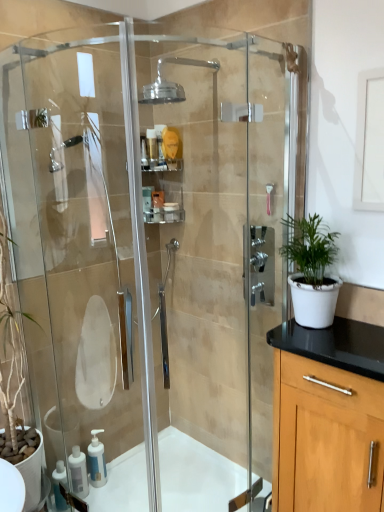
Question: Visually, is white glossy bath at lower left positioned to the left or to the right of clear plastic container at center, the 3th toiletry positioned from the bottom?

Choices:
 (A) left
 (B) right

Answer: (B)

Question: From the image's perspective, is white glossy bath at lower left located above or below clear plastic container at center, the 3th toiletry positioned from the bottom?

Choices:
 (A) above
 (B) below

Answer: (B)

Question: Which object is positioned closest to the transparent glass shower door at left?

Choices:
 (A) clear plastic shelf at upper center
 (B) white glossy bath at lower left
 (C) clear glass shower head at upper center
 (D) white matte pot at right
 (E) white plastic soap dispenser at lower left, arranged as the second soap dispenser when viewed from the left

Answer: (B)

Question: Which is farther from the white glossy bath at lower left?

Choices:
 (A) translucent plastic soap dispenser at lower left, acting as the 1th soap dispenser starting from the left
 (B) clear glass shower head at upper center
 (C) matte plastic container at upper center, which is counted as the second toiletry, starting from the bottom
 (D) clear plastic shelf at upper center
 (E) white plastic container at center, the 3th toiletry viewed from the top

Answer: (B)